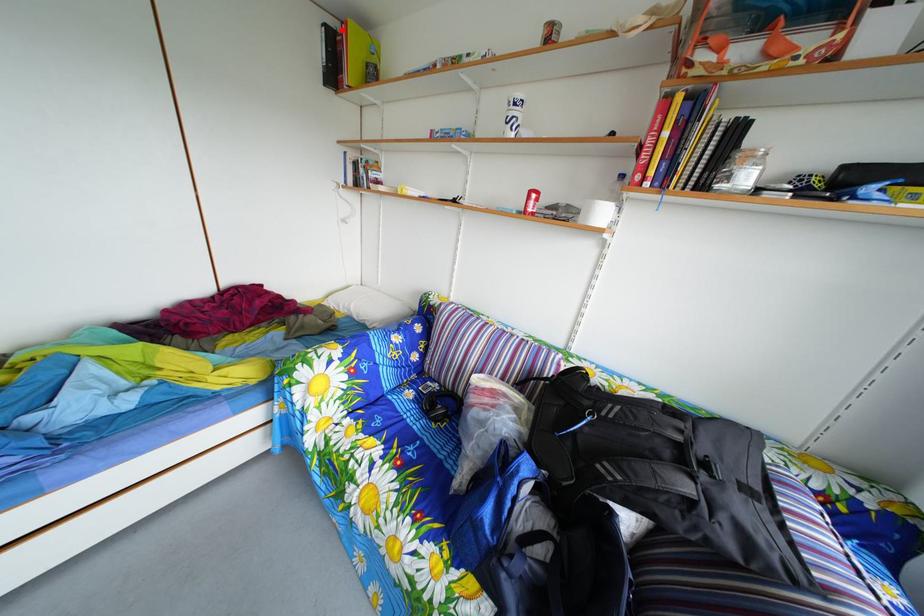
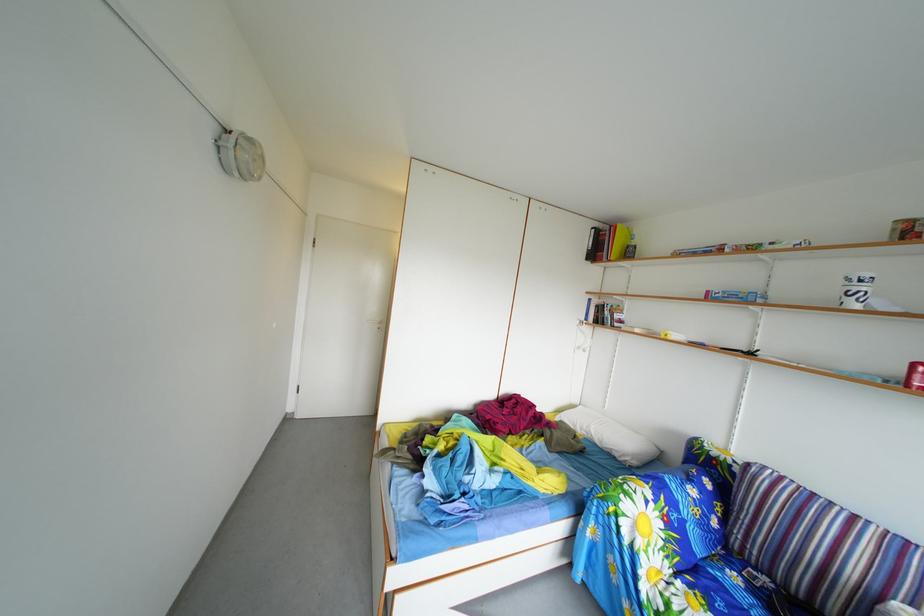
The point at the highlighted location is marked in the first image. Where is the corresponding point in the second image?

(608, 233)